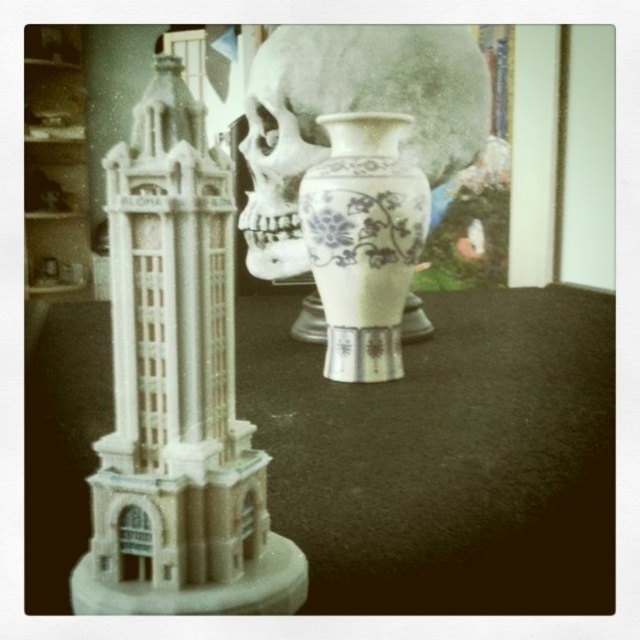
You are organizing a display and need to know which object takes up more space between the white matte tower at left and the white porcelain vase at center. Which one requires more space?

The white matte tower at left is larger in size than the white porcelain vase at center, so it requires more space.

Based on the photo, you are looking at the scene from the camera position. There are two points marked in the image, point 1 at coordinate point (x=147, y=145) and point 2 at coordinate point (x=380, y=211). Which point is closer to you?

Point (x=147, y=145) is closer to the camera than point (x=380, y=211).